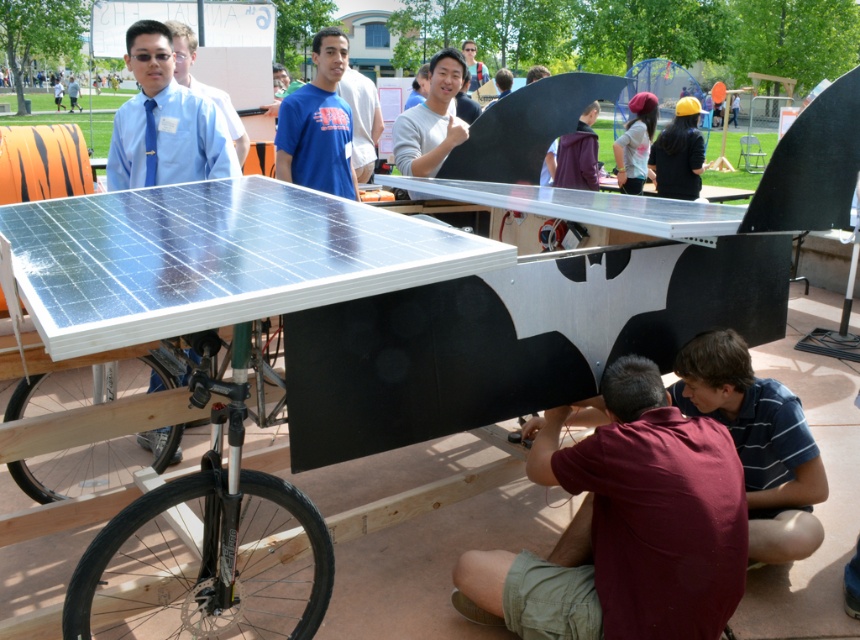
Question: Estimate the real-world distances between objects in this image. Which object is farther from the yellow matte baseball cap at upper right?

Choices:
 (A) blue shirt at upper center
 (B) smooth gray shirt at center
 (C) blue striped shirt at lower right

Answer: (C)

Question: Which object appears closest to the camera in this image?

Choices:
 (A) matte blue shirt at upper left
 (B) transparent plastic table at center

Answer: (B)

Question: Does maroon fabric shirt at lower center have a larger size compared to matte blue shirt at upper left?

Choices:
 (A) yes
 (B) no

Answer: (B)

Question: Does blue cotton shirt at center appear under matte blue shirt at upper left?

Choices:
 (A) yes
 (B) no

Answer: (A)

Question: Does blue cotton shirt at center appear under matte blue shirt at upper left?

Choices:
 (A) no
 (B) yes

Answer: (B)

Question: Estimate the real-world distances between objects in this image. Which object is farther from the matte blue shirt at left?

Choices:
 (A) blue striped shirt at lower right
 (B) transparent plastic table at center

Answer: (A)